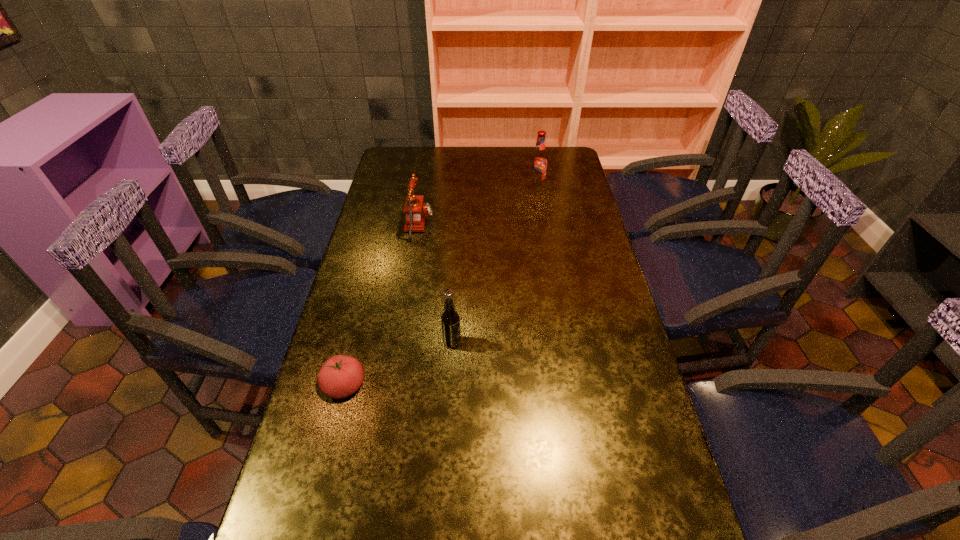
This screenshot has height=540, width=960. Identify the location of free point that satisfies the following two spatial constraints: 1. on the front side of the farthest object; 2. on the dial of the second farthest object. (543, 225).